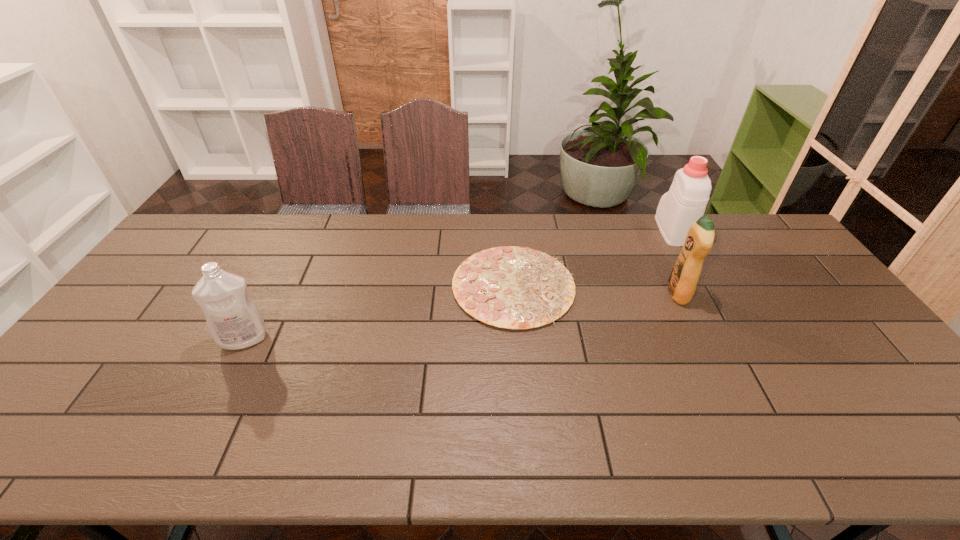
You are a GUI agent. You are given a task and a screenshot of the screen. Output one action in this format:
    pyautogui.click(x=<x>, y=<y>)
    Task: Click on the vacant region between the second detergent from right to left and the nearest detergent
    The width and height of the screenshot is (960, 540).
    Given the screenshot: What is the action you would take?
    pyautogui.click(x=461, y=316)

Find the location of a particular element. The height and width of the screenshot is (540, 960). vacant space that's between the farthest detergent and the third object from left to right is located at coordinates (675, 262).

At what (x,y) coordinates should I click in order to perform the action: click on free spot between the second detergent from left to right and the rightmost detergent. Please return your answer as a coordinate pair (x, y). This screenshot has height=540, width=960. Looking at the image, I should click on (675, 262).

Where is `vacant area that lies between the second object from left to right and the farthest detergent`? This screenshot has height=540, width=960. vacant area that lies between the second object from left to right and the farthest detergent is located at coordinates (593, 258).

You are a GUI agent. You are given a task and a screenshot of the screen. Output one action in this format:
    pyautogui.click(x=<x>, y=<y>)
    Task: Click on the unoccupied area between the pizza and the second nearest detergent
    This screenshot has width=960, height=540.
    Given the screenshot: What is the action you would take?
    pyautogui.click(x=596, y=289)

Select which object is the third closest to the rightmost detergent. Please provide its 2D coordinates. Your answer should be formatted as a tuple, i.e. [(x, y)], where the tuple contains the x and y coordinates of a point satisfying the conditions above.

[(234, 321)]

Locate which object is the closest to the rightmost object. Please provide its 2D coordinates. Your answer should be formatted as a tuple, i.e. [(x, y)], where the tuple contains the x and y coordinates of a point satisfying the conditions above.

[(683, 279)]

Locate an element on the screen. detergent that can be found as the second closest to the leftmost object is located at coordinates (685, 202).

Select which detergent appears as the second closest to the leftmost object. Please provide its 2D coordinates. Your answer should be formatted as a tuple, i.e. [(x, y)], where the tuple contains the x and y coordinates of a point satisfying the conditions above.

[(685, 202)]

Locate an element on the screen. The image size is (960, 540). vacant space that satisfies the following two spatial constraints: 1. on the label of the second farthest detergent; 2. on the front side of the nearest detergent is located at coordinates (700, 339).